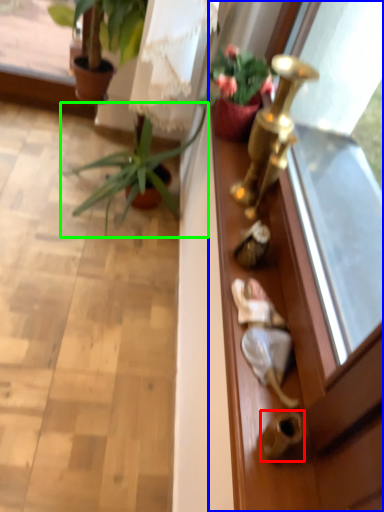
Question: Which is farther away from door handle (highlighted by a red box)? screen door (highlighted by a blue box) or houseplant (highlighted by a green box)?

Choices:
 (A) screen door
 (B) houseplant

Answer: (B)